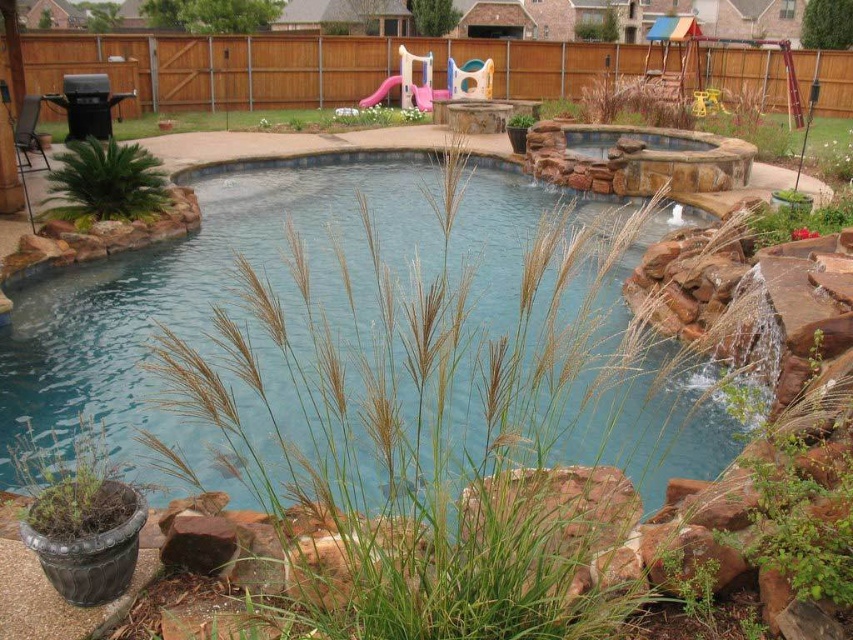
Who is positioned more to the left, blue stone pond at center or green grass at upper center?

Positioned to the left is green grass at upper center.

Is the position of blue stone pond at center less distant than that of green grass at upper center?

Yes, it is.

Which is in front, point (109, 440) or point (57, 131)?

Point (109, 440) is more forward.

In order to click on blue stone pond at center in this screenshot , I will do `click(265, 280)`.

Measure the distance from blue stone pond at center to green matte plant at lower left.

5.26 meters

Between point (508, 272) and point (51, 518), which one is positioned in front?

Point (51, 518) is more forward.

I want to click on blue stone pond at center, so click(x=265, y=280).

Locate an element on the screen. blue stone pond at center is located at coordinates (265, 280).

Does blue stone pond at center have a lesser width compared to green leafy plant at upper left?

No, blue stone pond at center is not thinner than green leafy plant at upper left.

Measure the distance between blue stone pond at center and camera.

7.84 feet

This screenshot has width=853, height=640. In order to click on blue stone pond at center in this screenshot , I will do `click(265, 280)`.